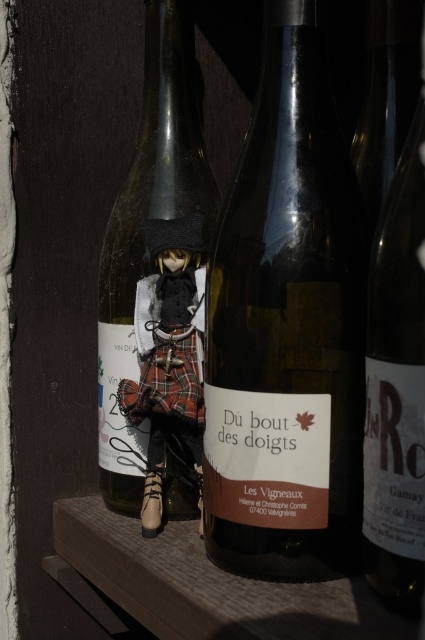
Is matte glass wine bottle at center below transparent glass wine bottle at center?

Yes, matte glass wine bottle at center is below transparent glass wine bottle at center.

Does point (286, 252) come in front of point (146, 243)?

Yes.

Does point (306, 228) come behind point (187, 385)?

No, (306, 228) is in front of (187, 385).

Locate an element on the screen. This screenshot has height=640, width=425. matte glass wine bottle at center is located at coordinates (291, 312).

In the scene shown: Is matte black wine at right taller than matte black doll at center?

Yes.

Which is behind, point (368, 572) or point (146, 243)?

Point (146, 243)

The width and height of the screenshot is (425, 640). What do you see at coordinates (396, 385) in the screenshot? I see `matte black wine at right` at bounding box center [396, 385].

Locate an element on the screen. This screenshot has width=425, height=640. matte black wine at right is located at coordinates 396,385.

Does point (159, 67) come in front of point (402, 288)?

That is False.

Which of these two, transparent glass wine bottle at center or matte black wine at right, stands shorter?

matte black wine at right

Where is `transparent glass wine bottle at center`? transparent glass wine bottle at center is located at coordinates (155, 288).